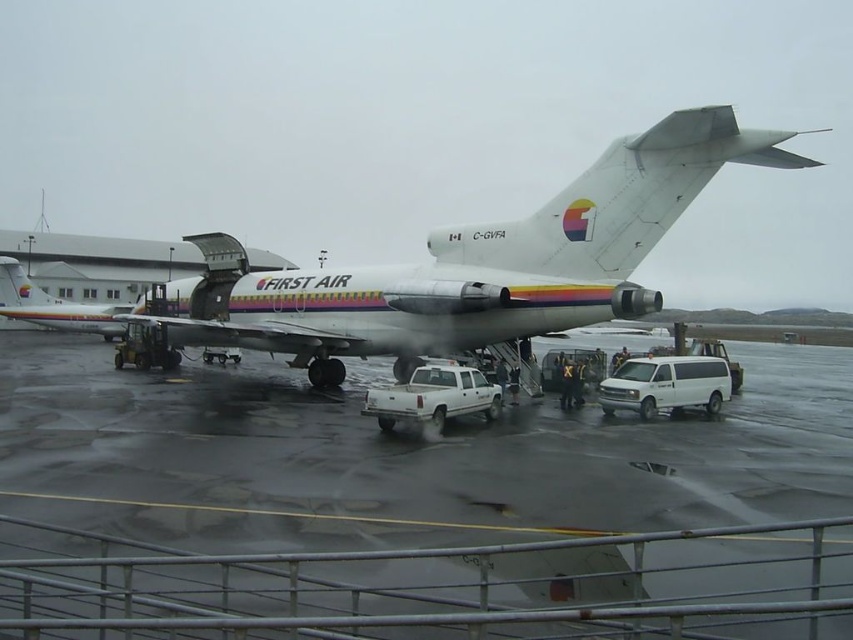
You are a maintenance worker needing to park a new van that is 2 meters wide. There is space between the white matte truck at center and the matte white airplane at left. Can the van fit in that space?

The white matte truck at center is narrower than the matte white airplane at left. However, the exact width of the space between them isn not specified. To determine if the van can fit, measure the available space between the two objects. If the space is at least 2 meters wide, the van can fit.

Based on the photo, you are standing at the point marked by the coordinates point (x=433, y=397) in the airport scene. What object are you standing on?

The point (x=433, y=397) indicates the white matte truck at center, so you are standing on the white matte truck at center.